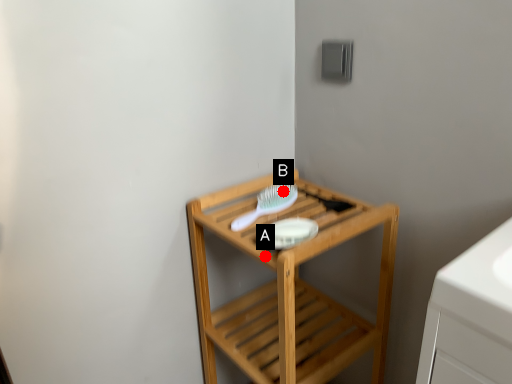
Question: Two points are circled on the image, labeled by A and B beside each circle. Among these points, which one is nearest to the camera?

Choices:
 (A) A is closer
 (B) B is closer

Answer: (A)